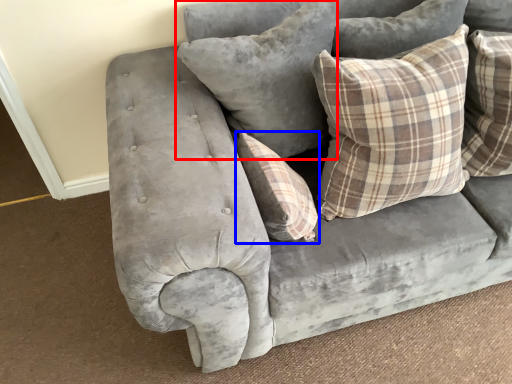
Question: Which point is closer to the camera, pillow (highlighted by a red box) or pillow (highlighted by a blue box)?

Choices:
 (A) pillow
 (B) pillow

Answer: (B)